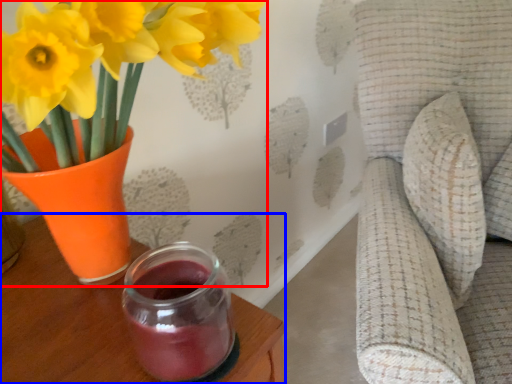
Question: Which point is further to the camera, houseplant (highlighted by a red box) or table (highlighted by a blue box)?

Choices:
 (A) houseplant
 (B) table

Answer: (B)